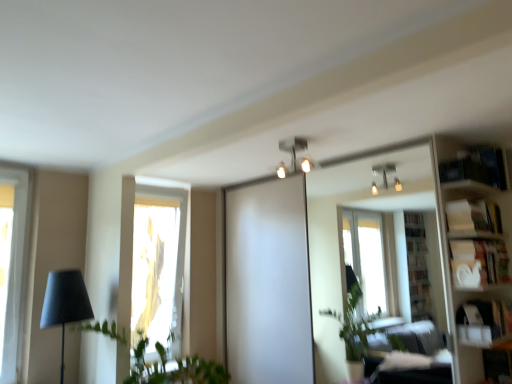
The width and height of the screenshot is (512, 384). Describe the element at coordinates (479, 263) in the screenshot. I see `white matte bookshelf at right, the third shelf in the top-to-bottom sequence` at that location.

Measure the distance between metallic silver light fixture at upper center and camera.

metallic silver light fixture at upper center is 2.81 meters from camera.

The width and height of the screenshot is (512, 384). Describe the element at coordinates (474, 264) in the screenshot. I see `white glossy bookshelf at right` at that location.

In order to face green leafy plant at left, should I rotate leftwards or rightwards?

Turn left approximately 12.478 degrees to face it.

Measure the distance between point (x=160, y=347) and camera.

Point (x=160, y=347) is 10.71 feet from camera.

What do you see at coordinates (473, 216) in the screenshot? This screenshot has width=512, height=384. I see `white cardboard box at upper right, positioned as the second shelf in bottom-to-top order` at bounding box center [473, 216].

You are a GUI agent. You are given a task and a screenshot of the screen. Output one action in this format:
    pyautogui.click(x=<x>, y=<y>)
    Task: Click on the white matte bookshelf at right, the third shelf in the top-to-bottom sequence
    The width and height of the screenshot is (512, 384).
    Given the screenshot: What is the action you would take?
    pyautogui.click(x=479, y=263)

Between green leafy plant at left and white glossy bookshelf at right, which one appears on the right side from the viewer's perspective?

Positioned to the right is white glossy bookshelf at right.

In the scene shown: From the image's perspective, is green leafy plant at left beneath white glossy bookshelf at right?

Indeed, from the image's perspective, green leafy plant at left is shown beneath white glossy bookshelf at right.

You are a GUI agent. You are given a task and a screenshot of the screen. Output one action in this format:
    pyautogui.click(x=<x>, y=<y>)
    Task: Click on the bookshelf on the right of green leafy plant at left
    This screenshot has width=512, height=384.
    Given the screenshot: What is the action you would take?
    pyautogui.click(x=474, y=264)

Is green leafy plant at left completely or partially outside of white glossy bookshelf at right?

green leafy plant at left is positioned outside white glossy bookshelf at right.

From the picture: Which of these two, translucent fabric at left or white matte bookshelf at right, the third shelf in the top-to-bottom sequence, is thinner?

white matte bookshelf at right, the third shelf in the top-to-bottom sequence, is thinner.

Is translucent fabric at left oriented towards white matte bookshelf at right, which ranks as the 1th shelf in bottom-to-top order?

No, translucent fabric at left is not oriented towards white matte bookshelf at right, which ranks as the 1th shelf in bottom-to-top order.

From the translucent fabric at left, count 2nd shelf to the right and point to it. Please provide its 2D coordinates.

[(479, 263)]

Is blue cardboard bookshelf at upper right, the first shelf from the top, shorter than white matte bookshelf at right, the third shelf in the top-to-bottom sequence?

No.

Can you confirm if blue cardboard bookshelf at upper right, the first shelf from the top, is smaller than white matte bookshelf at right, which ranks as the 1th shelf in bottom-to-top order?

Yes, blue cardboard bookshelf at upper right, the first shelf from the top, is smaller than white matte bookshelf at right, which ranks as the 1th shelf in bottom-to-top order.

Locate an element on the screen. This screenshot has height=384, width=512. the 2nd shelf above when counting from the white matte bookshelf at right, which ranks as the 1th shelf in bottom-to-top order (from the image's perspective) is located at coordinates (477, 167).

Is green leafy plant at left facing away from white cardboard box at upper right, acting as the second shelf starting from the top?

No, white cardboard box at upper right, acting as the second shelf starting from the top, is not at the back of green leafy plant at left.

From the image's perspective, is green leafy plant at left positioned above or below white cardboard box at upper right, acting as the second shelf starting from the top?

From the image's perspective, green leafy plant at left appears below white cardboard box at upper right, acting as the second shelf starting from the top.

From a real-world perspective, who is located lower, green leafy plant at left or white cardboard box at upper right, acting as the second shelf starting from the top?

From a 3D spatial view, green leafy plant at left is below.

How many degrees apart are the facing directions of green leafy plant at left and white cardboard box at upper right, positioned as the second shelf in bottom-to-top order?

There is a 92.1-degree angle between the facing directions of green leafy plant at left and white cardboard box at upper right, positioned as the second shelf in bottom-to-top order.

Is white cardboard box at upper right, positioned as the second shelf in bottom-to-top order, taller than white matte bookshelf at right, the third shelf in the top-to-bottom sequence?

Incorrect, the height of white cardboard box at upper right, positioned as the second shelf in bottom-to-top order, is not larger of that of white matte bookshelf at right, the third shelf in the top-to-bottom sequence.

Would you say white cardboard box at upper right, positioned as the second shelf in bottom-to-top order, is to the left or to the right of white matte bookshelf at right, the third shelf in the top-to-bottom sequence, in the picture?

In the image, white cardboard box at upper right, positioned as the second shelf in bottom-to-top order, appears on the left side of white matte bookshelf at right, the third shelf in the top-to-bottom sequence.

Are white cardboard box at upper right, positioned as the second shelf in bottom-to-top order, and white matte bookshelf at right, which ranks as the 1th shelf in bottom-to-top order, far apart?

No, white cardboard box at upper right, positioned as the second shelf in bottom-to-top order, is in close proximity to white matte bookshelf at right, which ranks as the 1th shelf in bottom-to-top order.

Does white cardboard box at upper right, positioned as the second shelf in bottom-to-top order, contain white matte bookshelf at right, the third shelf in the top-to-bottom sequence?

No, white matte bookshelf at right, the third shelf in the top-to-bottom sequence, is located outside of white cardboard box at upper right, positioned as the second shelf in bottom-to-top order.

Identify the location of lamp above the white glossy bookshelf at right (from the image's perspective). (293, 148).

Is metallic silver light fixture at upper center not inside white glossy bookshelf at right?

Yes, metallic silver light fixture at upper center is not within white glossy bookshelf at right.

From a real-world perspective, is metallic silver light fixture at upper center positioned above or below white glossy bookshelf at right?

metallic silver light fixture at upper center is above white glossy bookshelf at right.

Is metallic silver light fixture at upper center to the left of white glossy bookshelf at right from the viewer's perspective?

Correct, you'll find metallic silver light fixture at upper center to the left of white glossy bookshelf at right.

Is matte black lamp at left spatially inside metallic silver light fixture at upper center, or outside of it?

matte black lamp at left cannot be found inside metallic silver light fixture at upper center.

Considering the sizes of matte black lamp at left and metallic silver light fixture at upper center in the image, is matte black lamp at left bigger or smaller than metallic silver light fixture at upper center?

Considering their sizes, matte black lamp at left takes up more space than metallic silver light fixture at upper center.

Considering the sizes of objects matte black lamp at left and metallic silver light fixture at upper center in the image provided, who is shorter, matte black lamp at left or metallic silver light fixture at upper center?

metallic silver light fixture at upper center.

Which is more to the right, matte black lamp at left or metallic silver light fixture at upper center?

Positioned to the right is metallic silver light fixture at upper center.

This screenshot has height=384, width=512. Identify the location of bookshelf on the right of green leafy plant at left. (474, 264).

Locate an element on the screen. This screenshot has width=512, height=384. window below the white matte bookshelf at right, the third shelf in the top-to-bottom sequence (from the image's perspective) is located at coordinates pyautogui.click(x=158, y=267).

Looking at the image, which one is located further to metallic silver light fixture at upper center, translucent fabric at left or green leafy plant at left?

green leafy plant at left lies further to metallic silver light fixture at upper center than the other object.

Based on their spatial positions, is green leafy plant at left or translucent fabric at left closer to matte black lamp at left?

Based on the image, green leafy plant at left appears to be nearer to matte black lamp at left.

From the image, which object appears to be farther from green leafy plant at left, clear glass mirror at upper center or white cardboard box at upper right, positioned as the second shelf in bottom-to-top order?

The object further to green leafy plant at left is white cardboard box at upper right, positioned as the second shelf in bottom-to-top order.

Based on their spatial positions, is green leafy plant at left or white matte bookshelf at right, the third shelf in the top-to-bottom sequence, closer to white cardboard box at upper right, acting as the second shelf starting from the top?

white matte bookshelf at right, the third shelf in the top-to-bottom sequence, lies closer to white cardboard box at upper right, acting as the second shelf starting from the top, than the other object.

In the scene shown: Considering their positions, is metallic silver light fixture at upper center positioned closer to translucent fabric at left than green leafy plant at left?

green leafy plant at left lies closer to translucent fabric at left than the other object.

From the image, which object appears to be farther from matte black lamp at left, white cardboard box at upper right, acting as the second shelf starting from the top, or white matte bookshelf at right, which ranks as the 1th shelf in bottom-to-top order?

The object further to matte black lamp at left is white cardboard box at upper right, acting as the second shelf starting from the top.

From the image, which object appears to be nearer to white glossy bookshelf at right, clear glass mirror at upper center or translucent fabric at left?

clear glass mirror at upper center is positioned closer to the anchor white glossy bookshelf at right.

From the picture: Which object lies nearer to the anchor point matte black lamp at left, green leafy plant at left or white cardboard box at upper right, acting as the second shelf starting from the top?

green leafy plant at left is closer to matte black lamp at left.

You are a GUI agent. You are given a task and a screenshot of the screen. Output one action in this format:
    pyautogui.click(x=<x>, y=<y>)
    Task: Click on the lamp between translucent fabric at left and white glossy bookshelf at right
    Image resolution: width=512 pixels, height=384 pixels.
    Given the screenshot: What is the action you would take?
    pyautogui.click(x=293, y=148)

The height and width of the screenshot is (384, 512). What are the coordinates of `mirror situated between metallic silver light fixture at upper center and blue cardboard bookshelf at upper right, the third shelf positioned from the bottom, from left to right` in the screenshot? It's located at (376, 233).

In order to click on bookshelf between matte black lamp at left and white matte bookshelf at right, the third shelf in the top-to-bottom sequence in this screenshot , I will do `click(474, 264)`.

This screenshot has height=384, width=512. In order to click on lamp between matte black lamp at left and white cardboard box at upper right, positioned as the second shelf in bottom-to-top order, in the horizontal direction in this screenshot , I will do (x=293, y=148).